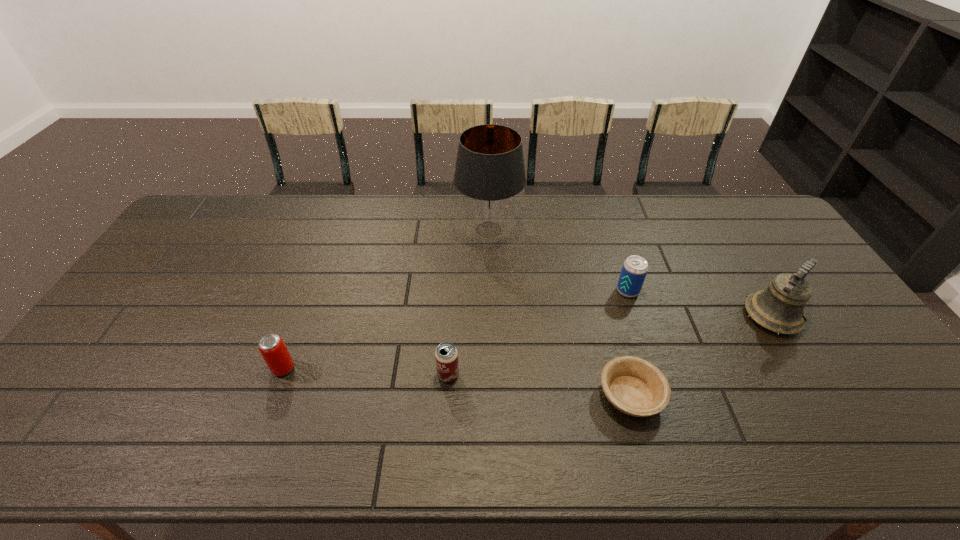
Where is `free space located 0.300m on the back of the farthest beer can`? The image size is (960, 540). free space located 0.300m on the back of the farthest beer can is located at coordinates (606, 222).

The height and width of the screenshot is (540, 960). What are the coordinates of `vacant space located on the right of the leftmost object` in the screenshot? It's located at (426, 368).

The image size is (960, 540). I want to click on free space located on the left of the second beer can from right to left, so [280, 375].

Locate an element on the screen. This screenshot has width=960, height=540. vacant space positioned on the left of the bowl is located at coordinates (450, 395).

At what (x,y) coordinates should I click in order to perform the action: click on object positioned at the far edge. Please return your answer as a coordinate pair (x, y). This screenshot has width=960, height=540. Looking at the image, I should click on (489, 172).

This screenshot has height=540, width=960. In order to click on object present at the near edge in this screenshot , I will do `click(635, 386)`.

The width and height of the screenshot is (960, 540). Find the location of `object positioned at the right edge`. object positioned at the right edge is located at coordinates (780, 308).

In the image, there is a desktop. At what (x,y) coordinates should I click in order to perform the action: click on vacant space at the far edge. Please return your answer as a coordinate pair (x, y). The image size is (960, 540). Looking at the image, I should click on (360, 195).

Locate an element on the screen. The height and width of the screenshot is (540, 960). vacant space at the near edge of the desktop is located at coordinates (683, 437).

Locate an element on the screen. vacant space at the left edge is located at coordinates (105, 418).